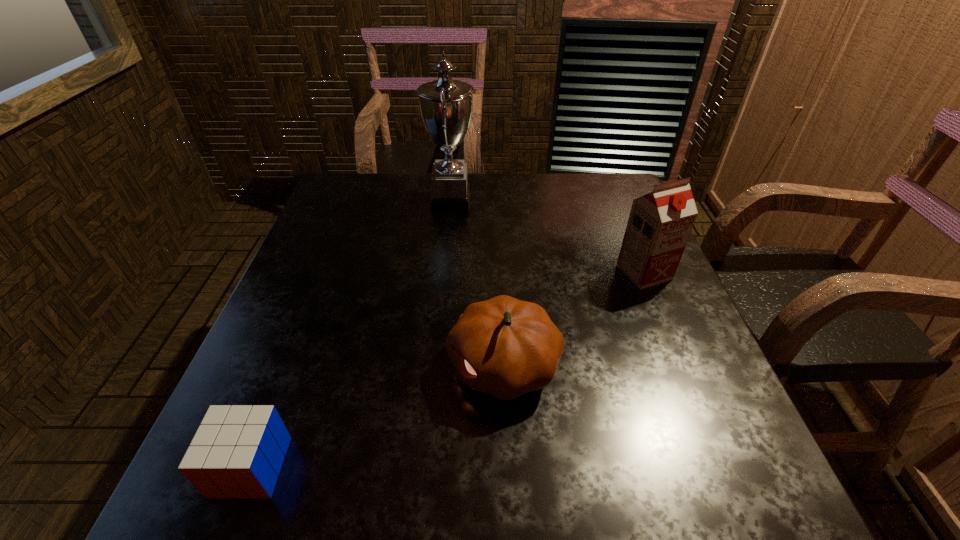
At what (x,y) coordinates should I click in order to perform the action: click on the tallest object. Please return your answer as a coordinate pair (x, y). The image size is (960, 540). Looking at the image, I should click on coord(446,105).

The height and width of the screenshot is (540, 960). In order to click on trophy cup in this screenshot , I will do `click(446, 105)`.

Where is `the rightmost object`? The image size is (960, 540). the rightmost object is located at coordinates (659, 225).

Identify the location of soya milk. (659, 225).

Locate an element on the screen. the second nearest object is located at coordinates (505, 347).

At what (x,y) coordinates should I click in order to perform the action: click on pumpkin. Please return your answer as a coordinate pair (x, y). The image size is (960, 540). Looking at the image, I should click on (505, 347).

I want to click on the leftmost object, so click(237, 452).

Locate an element on the screen. cube is located at coordinates (237, 452).

Where is `free space located 0.340m at the front view of the farthest object`? free space located 0.340m at the front view of the farthest object is located at coordinates (590, 200).

At what (x,y) coordinates should I click in order to perform the action: click on free space located 0.310m on the front of the rightmost object. Please return your answer as a coordinate pair (x, y). This screenshot has width=960, height=540. Looking at the image, I should click on (702, 409).